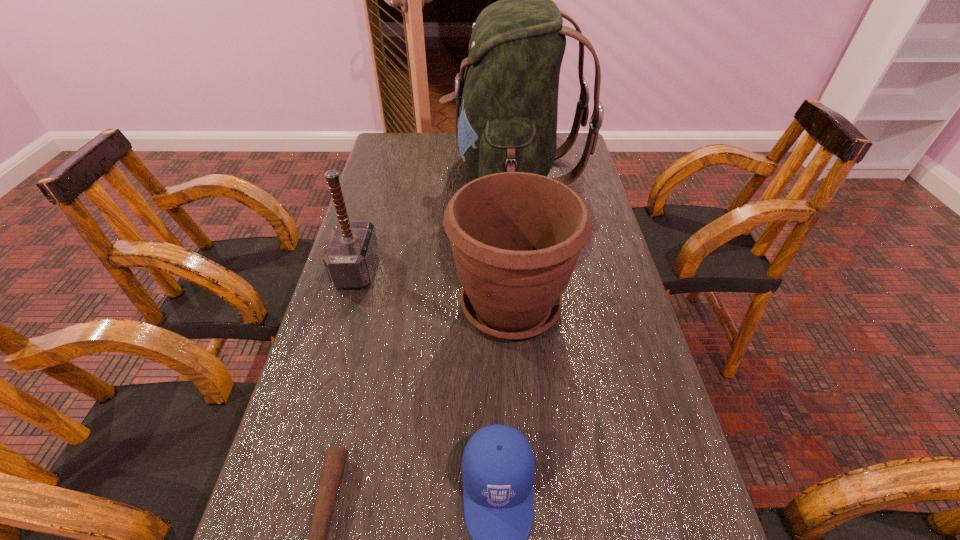
Where is `the farthest object`? The image size is (960, 540). the farthest object is located at coordinates (508, 97).

I want to click on backpack, so tap(508, 97).

At what (x,y) coordinates should I click in order to perform the action: click on the taller hammer. Please return your answer as a coordinate pair (x, y). The image size is (960, 540). Looking at the image, I should click on (350, 257).

Find the location of a particular element. The image size is (960, 540). flowerpot is located at coordinates (516, 237).

Find the location of a particular element. This screenshot has width=960, height=540. vacant region located on the open flap of the tallest object is located at coordinates (399, 173).

The width and height of the screenshot is (960, 540). Find the location of `vacant region located on the open flap of the tallest object`. vacant region located on the open flap of the tallest object is located at coordinates (382, 173).

Find the location of a particular element. free spot located on the back of the farther hammer is located at coordinates (384, 175).

You are a GUI agent. You are given a task and a screenshot of the screen. Output one action in this format:
    pyautogui.click(x=<x>, y=<y>)
    Task: Click on the blank space located on the back of the flowerpot
    
    Given the screenshot: What is the action you would take?
    pyautogui.click(x=504, y=206)

The height and width of the screenshot is (540, 960). What are the coordinates of `object present at the far edge` in the screenshot? It's located at (508, 97).

The width and height of the screenshot is (960, 540). Find the location of `object present at the left edge`. object present at the left edge is located at coordinates (350, 257).